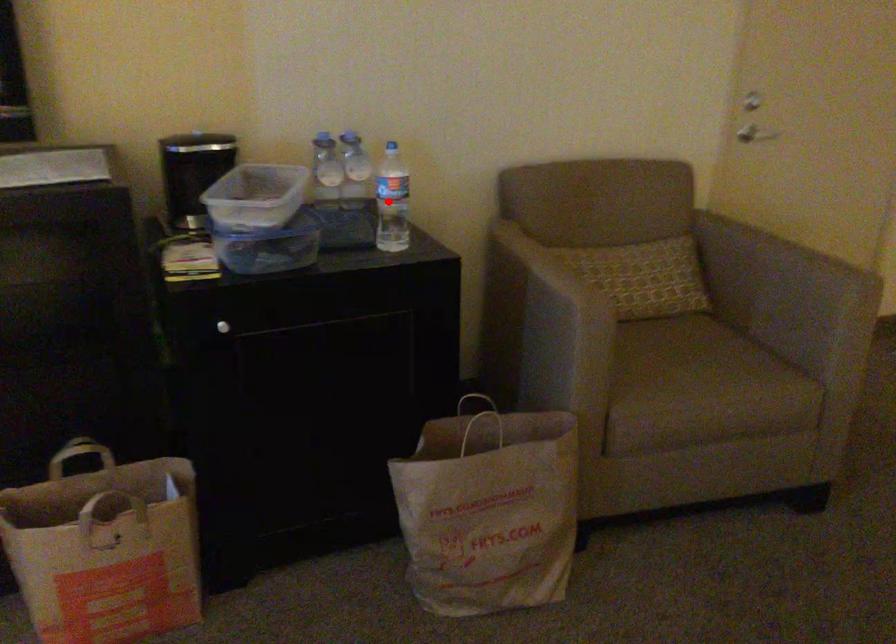
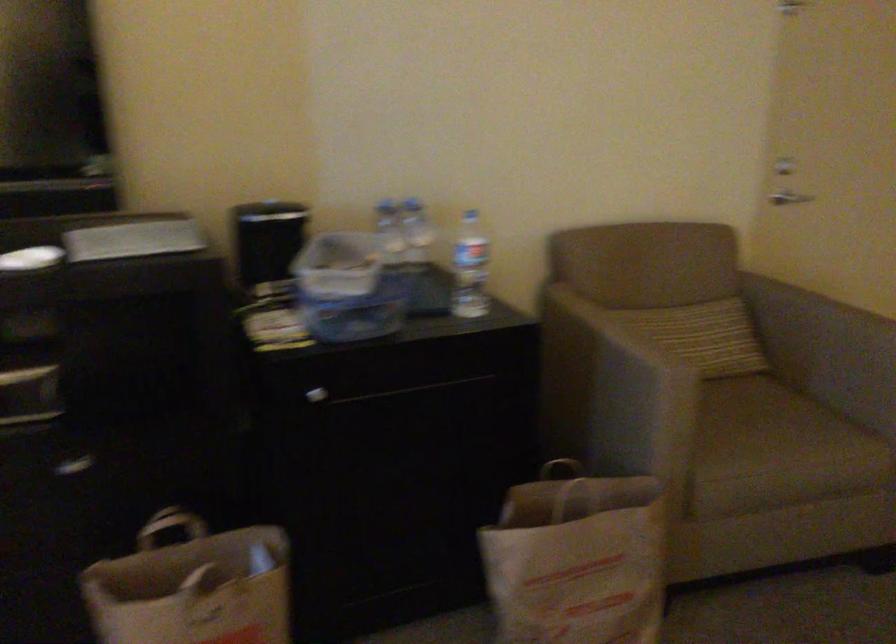
In the second image, find the point that corresponds to the highlighted location in the first image.

(470, 268)